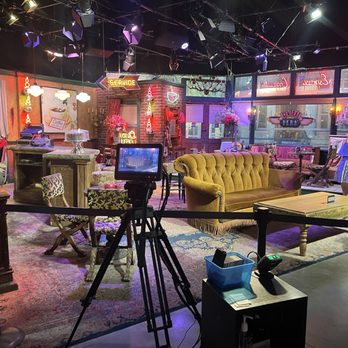
In order to click on simulated brick pattern in this screenshot , I will do `click(144, 116)`, `click(102, 99)`.